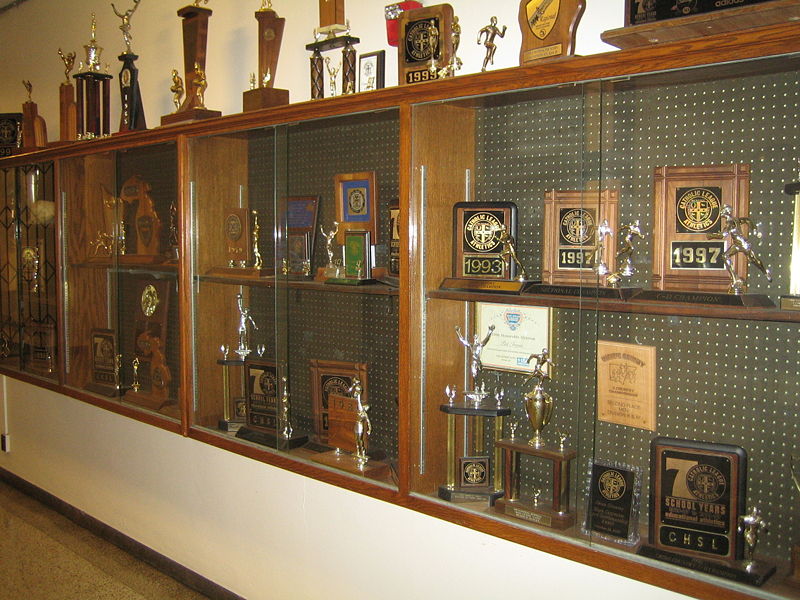
What are the coordinates of `plaque` in the screenshot? It's located at (689, 483).